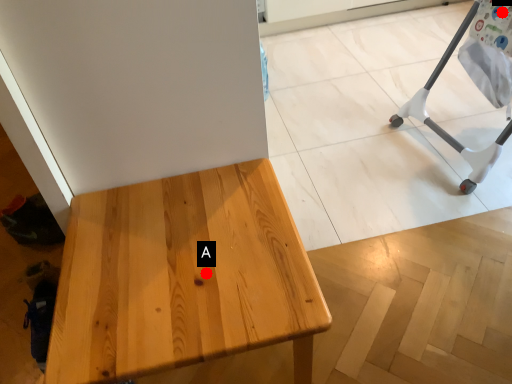
Question: Two points are circled on the image, labeled by A and B beside each circle. Which point is farther to the camera?

Choices:
 (A) A is further
 (B) B is further

Answer: (B)